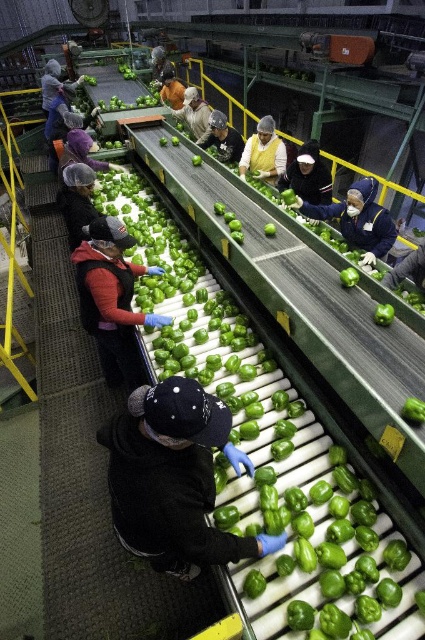
Between dark blue fleece jacket at center and dark gray fabric at center, which one has less height?

With less height is dark gray fabric at center.

Between dark blue fleece jacket at center and dark gray fabric at center, which one is positioned lower?

dark blue fleece jacket at center

This screenshot has width=425, height=640. In order to click on dark blue fleece jacket at center in this screenshot , I will do `click(173, 477)`.

The image size is (425, 640). What are the coordinates of `dark blue fleece jacket at center` in the screenshot? It's located at (173, 477).

Is yellow fabric at center to the right of brown hair at center from the viewer's perspective?

Correct, you'll find yellow fabric at center to the right of brown hair at center.

I want to click on yellow fabric at center, so click(263, 152).

At what (x,y) coordinates should I click in order to perform the action: click on yellow fabric at center. Please return your answer as a coordinate pair (x, y). The width and height of the screenshot is (425, 640). Looking at the image, I should click on (263, 152).

Is the position of blue fabric gloves at center more distant than that of matte black jacket at upper left?

No, it is not.

Who is more distant from viewer, (393, 225) or (76, 84)?

The point (76, 84) is more distant.

Find the location of `blue fabric gloves at center`. blue fabric gloves at center is located at coordinates (357, 220).